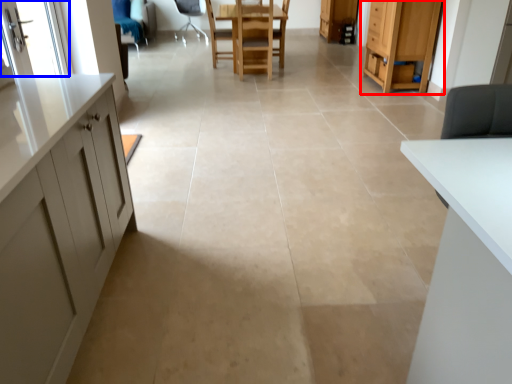
Question: Among these objects, which one is farthest to the camera, cabinetry (highlighted by a red box) or screen door (highlighted by a blue box)?

Choices:
 (A) cabinetry
 (B) screen door

Answer: (A)